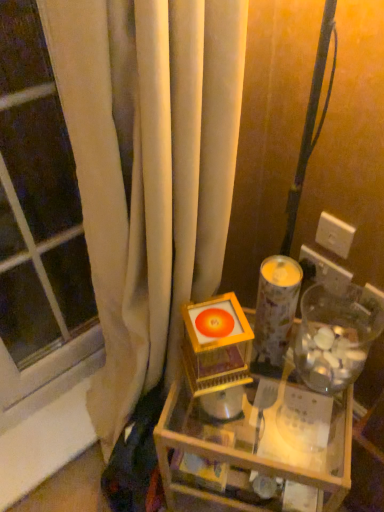
Identify the location of white plastic electric outlet at upper right, the 2th electric outlet viewed from the top. (324, 271).

Considering the relative sizes of transparent plastic jar at right and patterned paper candle holder at center in the image provided, is transparent plastic jar at right shorter than patterned paper candle holder at center?

Indeed, transparent plastic jar at right has a lesser height compared to patterned paper candle holder at center.

Looking at this image, is transparent plastic jar at right behind patterned paper candle holder at center?

No, transparent plastic jar at right is in front of patterned paper candle holder at center.

From the image's perspective, which one is positioned lower, transparent plastic jar at right or patterned paper candle holder at center?

transparent plastic jar at right, from the image's perspective.

In terms of width, does transparent plastic jar at right look wider or thinner when compared to patterned paper candle holder at center?

In the image, transparent plastic jar at right appears to be wider than patterned paper candle holder at center.

Considering the relative positions of patterned paper candle holder at center and orange glossy disc at center in the image provided, is patterned paper candle holder at center to the left of orange glossy disc at center from the viewer's perspective?

In fact, patterned paper candle holder at center is to the right of orange glossy disc at center.

Which is correct: patterned paper candle holder at center is inside orange glossy disc at center, or outside of it?

patterned paper candle holder at center cannot be found inside orange glossy disc at center.

Can you tell me how much patterned paper candle holder at center and orange glossy disc at center differ in facing direction?

patterned paper candle holder at center and orange glossy disc at center are facing 1.48 degrees away from each other.

Who is shorter, white plastic electric outlet at upper right, the first electric outlet in the bottom-to-top sequence, or white plastic electric outlet at upper right, arranged as the first electric outlet when viewed from the top?

white plastic electric outlet at upper right, arranged as the first electric outlet when viewed from the top, is shorter.

Considering the relative sizes of white plastic electric outlet at upper right, the first electric outlet in the bottom-to-top sequence, and white plastic electric outlet at upper right, arranged as the first electric outlet when viewed from the top, in the image provided, is white plastic electric outlet at upper right, the first electric outlet in the bottom-to-top sequence, thinner than white plastic electric outlet at upper right, arranged as the first electric outlet when viewed from the top,?

No, white plastic electric outlet at upper right, the first electric outlet in the bottom-to-top sequence, is not thinner than white plastic electric outlet at upper right, arranged as the first electric outlet when viewed from the top.

Which point is more forward, (304, 272) or (345, 234)?

The point (345, 234) is in front.

Looking at this image, is white plastic electric outlet at upper right, the first electric outlet in the bottom-to-top sequence, with white plastic electric outlet at upper right, arranged as the first electric outlet when viewed from the top?

Yes, white plastic electric outlet at upper right, the first electric outlet in the bottom-to-top sequence, is beside white plastic electric outlet at upper right, arranged as the first electric outlet when viewed from the top.

From a real-world perspective, between wooden table at center and transparent glass window at left, who is vertically higher?

In real-world perspective, transparent glass window at left is above.

Is wooden table at center facing away from transparent glass window at left?

That's not correct — wooden table at center is not looking away from transparent glass window at left.

Identify the location of table on the right of transparent glass window at left. The height and width of the screenshot is (512, 384). (256, 447).

Does point (173, 441) lie in front of point (7, 158)?

Yes.

Are transparent plastic jar at right and wooden table at center far apart?

No, transparent plastic jar at right is not far away from wooden table at center.

Which is in front, point (326, 362) or point (189, 440)?

Point (326, 362)

Between transparent plastic jar at right and wooden table at center, which one has larger size?

wooden table at center is bigger.

Consider the image. Does transparent plastic jar at right appear on the left side of wooden table at center?

No, transparent plastic jar at right is not to the left of wooden table at center.

Is orange glossy disc at center positioned with its back to wooden table at center?

No.

Is orange glossy disc at center located outside wooden table at center?

→ Yes, orange glossy disc at center is located beyond the bounds of wooden table at center.

Considering the relative sizes of orange glossy disc at center and wooden table at center in the image provided, is orange glossy disc at center shorter than wooden table at center?

Yes, orange glossy disc at center is shorter than wooden table at center.

How different are the orientations of orange glossy disc at center and wooden table at center in degrees?

The facing directions of orange glossy disc at center and wooden table at center are 30.7 degrees apart.

Is patterned paper candle holder at center shorter than white plastic electric outlet at upper right, placed as the 2th electric outlet when sorted from bottom to top?

No.

Is patterned paper candle holder at center positioned beyond the bounds of white plastic electric outlet at upper right, placed as the 2th electric outlet when sorted from bottom to top?

Yes.

Can you confirm if patterned paper candle holder at center is positioned to the right of white plastic electric outlet at upper right, arranged as the first electric outlet when viewed from the top?

No, patterned paper candle holder at center is not to the right of white plastic electric outlet at upper right, arranged as the first electric outlet when viewed from the top.

From a real-world perspective, relative to white plastic electric outlet at upper right, arranged as the first electric outlet when viewed from the top, is patterned paper candle holder at center vertically above or below?

From a real-world perspective, patterned paper candle holder at center is physically below white plastic electric outlet at upper right, arranged as the first electric outlet when viewed from the top.

Where is `candle holder above the transparent plastic jar at right (from the image's perspective)`? This screenshot has height=512, width=384. candle holder above the transparent plastic jar at right (from the image's perspective) is located at coordinates (276, 307).

Identify the location of toy below the patterned paper candle holder at center (from a real-world perspective). (217, 354).

Estimate the real-world distances between objects in this image. Which object is closer to transparent glass window at left, white plastic electric outlet at upper right, arranged as the first electric outlet when viewed from the top, or wooden table at center?

The object closer to transparent glass window at left is wooden table at center.

Considering their positions, is orange glossy disc at center positioned closer to transparent glass window at left than patterned paper candle holder at center?

orange glossy disc at center is closer to transparent glass window at left.

Looking at the image, which one is located further to transparent plastic jar at right, white plastic electric outlet at upper right, placed as the 2th electric outlet when sorted from bottom to top, or patterned paper candle holder at center?

The object further to transparent plastic jar at right is white plastic electric outlet at upper right, placed as the 2th electric outlet when sorted from bottom to top.

From the image, which object appears to be nearer to white plastic electric outlet at upper right, arranged as the first electric outlet when viewed from the top, transparent glass window at left or white plastic electric outlet at upper right, the 2th electric outlet viewed from the top?

white plastic electric outlet at upper right, the 2th electric outlet viewed from the top, is closer to white plastic electric outlet at upper right, arranged as the first electric outlet when viewed from the top.

From the image, which object appears to be nearer to wooden table at center, white plastic electric outlet at upper right, placed as the 2th electric outlet when sorted from bottom to top, or transparent plastic jar at right?

The object closer to wooden table at center is transparent plastic jar at right.

Which object lies nearer to the anchor point white plastic electric outlet at upper right, the first electric outlet in the bottom-to-top sequence, patterned paper candle holder at center or white plastic electric outlet at upper right, arranged as the first electric outlet when viewed from the top?

white plastic electric outlet at upper right, arranged as the first electric outlet when viewed from the top.

Based on their spatial positions, is white plastic electric outlet at upper right, the 2th electric outlet viewed from the top, or orange glossy disc at center further from patterned paper candle holder at center?

Among the two, white plastic electric outlet at upper right, the 2th electric outlet viewed from the top, is located further to patterned paper candle holder at center.

When comparing their distances from transparent plastic jar at right, does wooden table at center or white plastic electric outlet at upper right, the 2th electric outlet viewed from the top, seem further?

The object further to transparent plastic jar at right is wooden table at center.

Find the location of a particular element. This screenshot has height=512, width=384. glass jar situated between orange glossy disc at center and white plastic electric outlet at upper right, the 2th electric outlet viewed from the top, from left to right is located at coordinates (336, 335).

Find the location of `candle holder between orange glossy disc at center and white plastic electric outlet at upper right, the 2th electric outlet viewed from the top, from left to right`. candle holder between orange glossy disc at center and white plastic electric outlet at upper right, the 2th electric outlet viewed from the top, from left to right is located at coordinates (276, 307).

The image size is (384, 512). Identify the location of candle holder between orange glossy disc at center and transparent plastic jar at right from left to right. (276, 307).

I want to click on electric outlet between patterned paper candle holder at center and white plastic electric outlet at upper right, the 2th electric outlet viewed from the top, from front to back, so tap(334, 234).